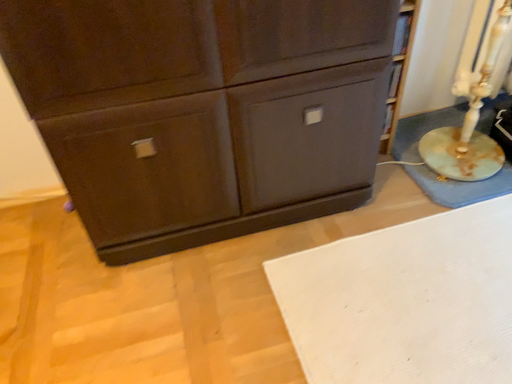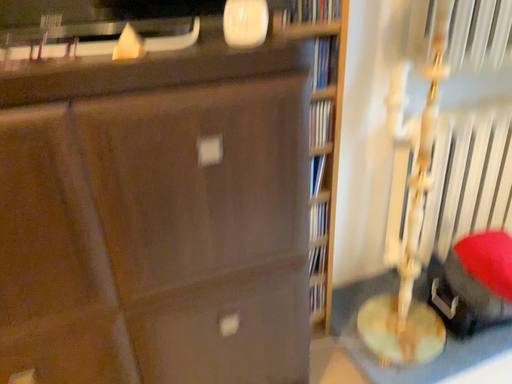
Question: How did the camera likely rotate when shooting the video?

Choices:
 (A) rotated downward
 (B) rotated upward

Answer: (B)